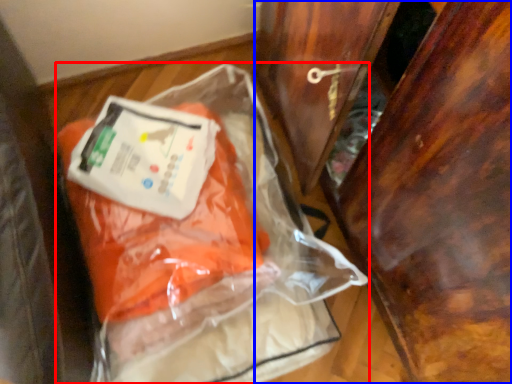
Question: Which point is closer to the camera, plastic bag (highlighted by a red box) or furniture (highlighted by a blue box)?

Choices:
 (A) plastic bag
 (B) furniture

Answer: (B)